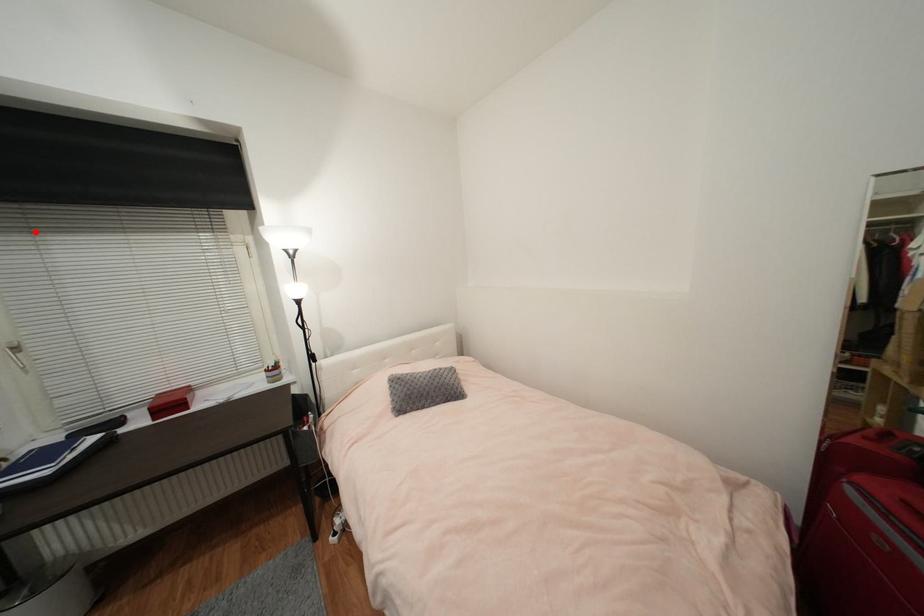
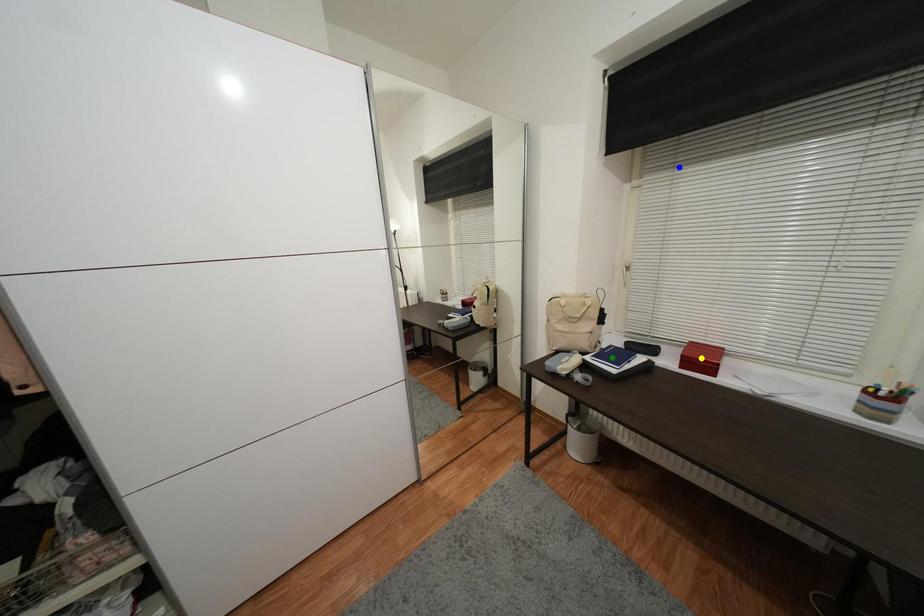
Question: I am providing you with two images of the same scene from different viewpoints. A red point is marked on the first image. You are given multiple points on the second image. Which point in image 2 represents the same 3d spot as the red point in image 1?

Choices:
 (A) yellow point
 (B) green point
 (C) blue point

Answer: (C)